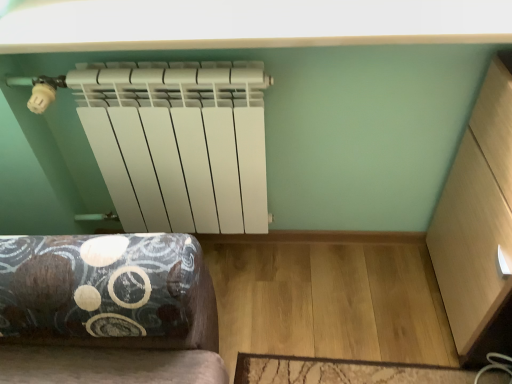
Image resolution: width=512 pixels, height=384 pixels. I want to click on free spot above white matte radiator at left (from a real-world perspective), so click(153, 66).